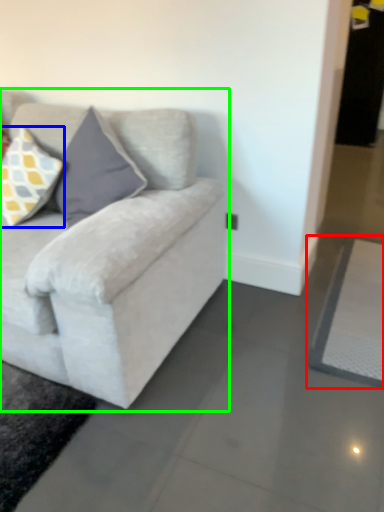
Question: Considering the real-world distances, which object is farthest from yoga mat (highlighted by a red box)? pillow (highlighted by a blue box) or studio couch (highlighted by a green box)?

Choices:
 (A) pillow
 (B) studio couch

Answer: (A)